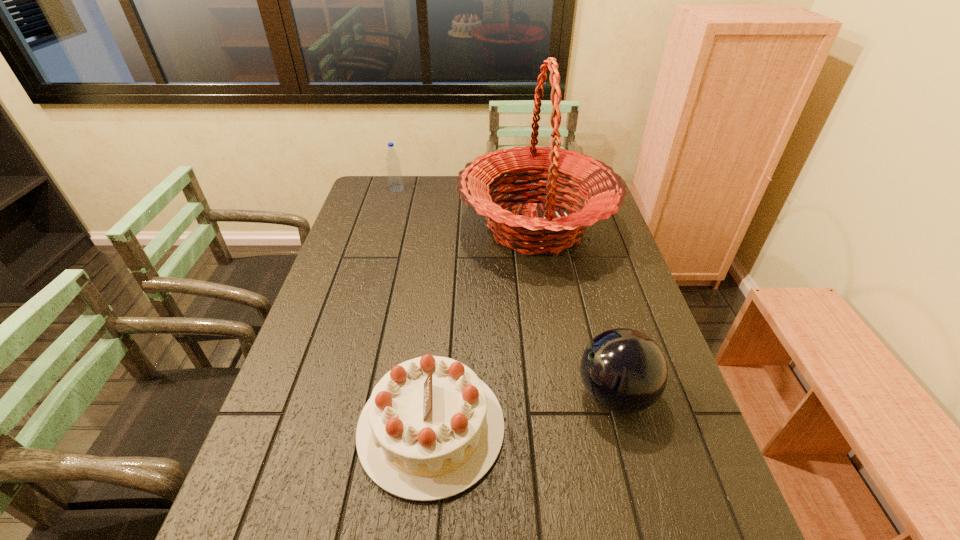
Find the location of `basket located in the far edge section of the desktop`. basket located in the far edge section of the desktop is located at coordinates (552, 234).

Identify the location of water bottle that is positioned at the far edge. (394, 172).

This screenshot has height=540, width=960. I want to click on object that is at the left edge, so click(394, 172).

At what (x,y) coordinates should I click in order to perform the action: click on basket located at the right edge. Please return your answer as a coordinate pair (x, y). Looking at the image, I should click on (552, 234).

The image size is (960, 540). What are the coordinates of `bowling ball positioned at the right edge` in the screenshot? It's located at (623, 370).

You are a GUI agent. You are given a task and a screenshot of the screen. Output one action in this format:
    pyautogui.click(x=<x>, y=<y>)
    Task: Click on the object positioned at the far left corner
    The width and height of the screenshot is (960, 540).
    Given the screenshot: What is the action you would take?
    pyautogui.click(x=394, y=172)

Image resolution: width=960 pixels, height=540 pixels. Find the location of `object that is at the far right corner`. object that is at the far right corner is located at coordinates (552, 234).

You are a GUI agent. You are given a task and a screenshot of the screen. Output one action in this format:
    pyautogui.click(x=<x>, y=<y>)
    Task: Click on the vacant space at the far edge of the desktop
    The width and height of the screenshot is (960, 540).
    Given the screenshot: What is the action you would take?
    pyautogui.click(x=419, y=192)

I want to click on free region at the left edge of the desktop, so click(322, 373).

The image size is (960, 540). Find the location of `free space at the right edge of the desktop`. free space at the right edge of the desktop is located at coordinates (633, 274).